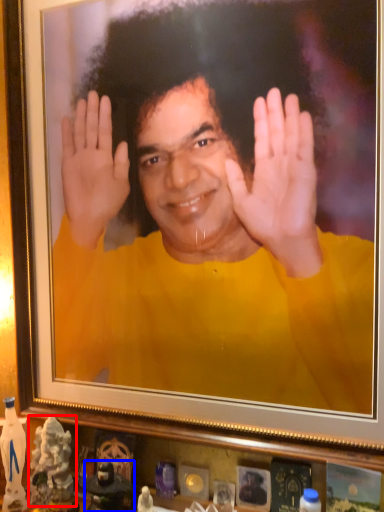
Question: Which object is further to the camera taking this photo, toy (highlighted by a red box) or toy (highlighted by a blue box)?

Choices:
 (A) toy
 (B) toy

Answer: (A)